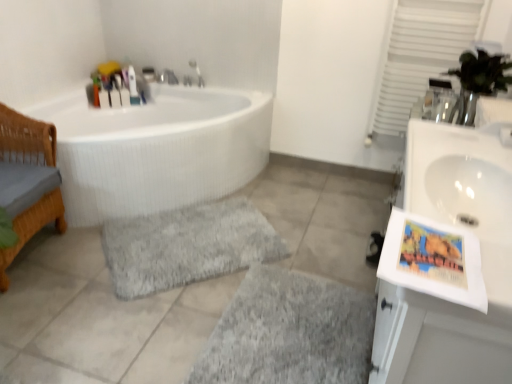
Question: Could you tell me if translucent plastic bottles at upper left, which is the 4th toiletry from right to left, is facing matte plastic toothbrush at upper left, which is counted as the 4th toiletry, starting from the left?

Choices:
 (A) no
 (B) yes

Answer: (A)

Question: Is translucent plastic bottles at upper left, which appears as the 1th toiletry when viewed from the left, facing away from matte plastic toothbrush at upper left, which is counted as the 4th toiletry, starting from the left?

Choices:
 (A) yes
 (B) no

Answer: (B)

Question: Is translucent plastic bottles at upper left, which appears as the 1th toiletry when viewed from the left, with matte plastic toothbrush at upper left, the first toiletry positioned from the right?

Choices:
 (A) yes
 (B) no

Answer: (B)

Question: Is translucent plastic bottles at upper left, which is the 4th toiletry from right to left, outside matte plastic toothbrush at upper left, the first toiletry positioned from the right?

Choices:
 (A) no
 (B) yes

Answer: (B)

Question: Does translucent plastic bottles at upper left, which is the 4th toiletry from right to left, appear on the right side of matte plastic toothbrush at upper left, which is counted as the 4th toiletry, starting from the left?

Choices:
 (A) yes
 (B) no

Answer: (B)

Question: From a real-world perspective, is translucent plastic bottles at upper left, which is the 4th toiletry from right to left, on matte plastic toothbrush at upper left, which is counted as the 4th toiletry, starting from the left?

Choices:
 (A) no
 (B) yes

Answer: (A)

Question: From a real-world perspective, does matte plastic toothbrush at upper left, which is counted as the 4th toiletry, starting from the left, stand above white glossy sink at right?

Choices:
 (A) no
 (B) yes

Answer: (A)

Question: Does matte plastic toothbrush at upper left, which is counted as the 4th toiletry, starting from the left, turn towards white glossy sink at right?

Choices:
 (A) yes
 (B) no

Answer: (A)

Question: Does matte plastic toothbrush at upper left, the first toiletry positioned from the right, lie behind white glossy sink at right?

Choices:
 (A) no
 (B) yes

Answer: (B)

Question: From a real-world perspective, is matte plastic toothbrush at upper left, which is counted as the 4th toiletry, starting from the left, positioned under white glossy sink at right based on gravity?

Choices:
 (A) yes
 (B) no

Answer: (A)

Question: Is matte plastic toothbrush at upper left, the first toiletry positioned from the right, to the left of white glossy sink at right from the viewer's perspective?

Choices:
 (A) no
 (B) yes

Answer: (B)

Question: Is matte plastic toothbrush at upper left, which is counted as the 4th toiletry, starting from the left, oriented away from white glossy sink at right?

Choices:
 (A) yes
 (B) no

Answer: (B)

Question: From a real-world perspective, is matte plastic toothbrush at upper left, the first toiletry positioned from the right, located beneath gray shaggy bath mat at center, the first bath mat positioned from the top?

Choices:
 (A) no
 (B) yes

Answer: (A)